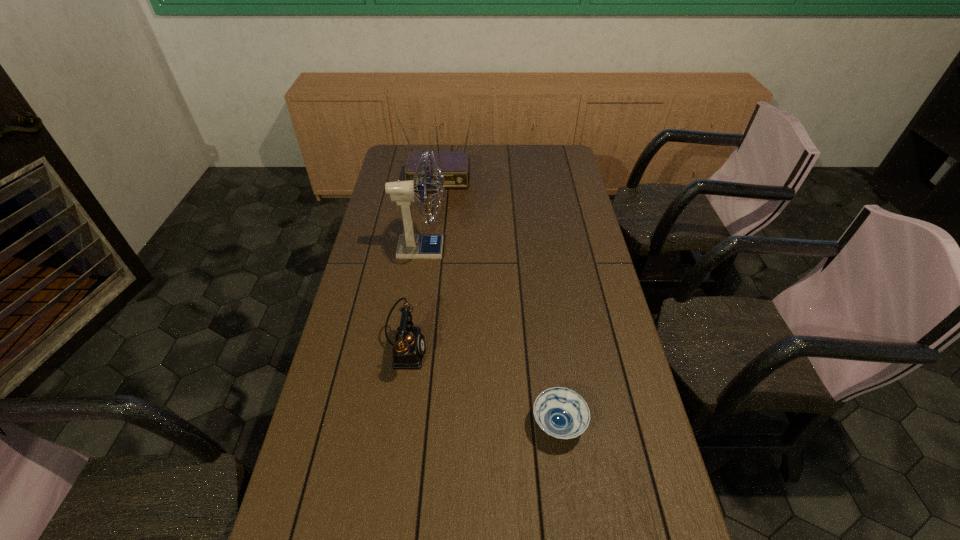
Identify the location of vacant area situated 0.300m on the front of the third farthest object at the rotary dial. (528, 351).

The width and height of the screenshot is (960, 540). I want to click on vacant space located 0.130m on the right of the rightmost object, so click(x=636, y=424).

Identify the location of object that is positioned at the far edge. (455, 166).

This screenshot has width=960, height=540. In order to click on fan at the left edge in this screenshot , I will do `click(410, 246)`.

Where is `radio_receiver positioned at the left edge`? radio_receiver positioned at the left edge is located at coordinates (455, 166).

Locate an element on the screen. The height and width of the screenshot is (540, 960). telephone present at the left edge is located at coordinates (408, 351).

Identify the location of object at the right edge. This screenshot has width=960, height=540. (562, 413).

Locate an element on the screen. This screenshot has height=540, width=960. object located at the far left corner is located at coordinates (455, 166).

In the image, there is a desktop. In order to click on vacant space at the far edge in this screenshot , I will do `click(487, 154)`.

The height and width of the screenshot is (540, 960). In the image, there is a desktop. What are the coordinates of `free space at the left edge` in the screenshot? It's located at (345, 322).